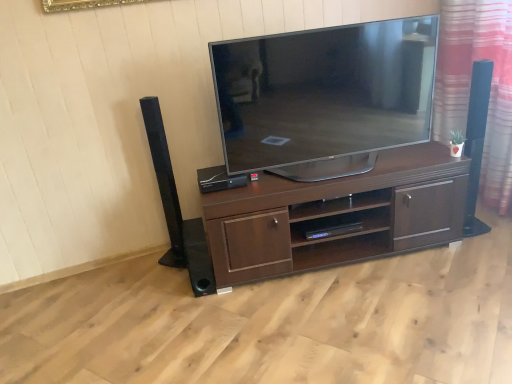
The height and width of the screenshot is (384, 512). I want to click on free point in front of velvet-like red curtain at right, so click(x=482, y=246).